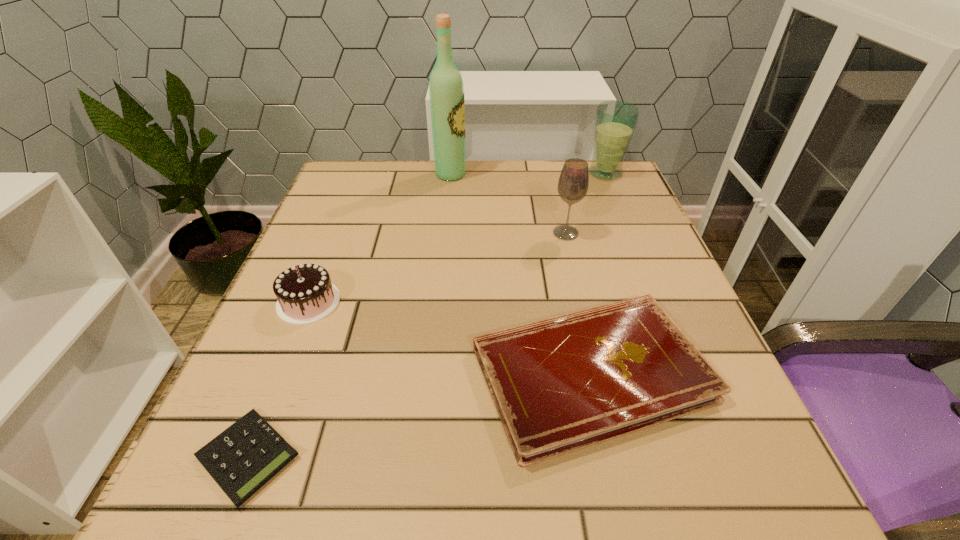
Identify which object is located as the second nearest to the calculator. Please provide its 2D coordinates. Your answer should be formatted as a tuple, i.e. [(x, y)], where the tuple contains the x and y coordinates of a point satisfying the conditions above.

[(565, 383)]

Where is `free location that satisfies the following two spatial constraints: 1. on the back side of the right glass drink container; 2. on the left side of the second shortest object`? The width and height of the screenshot is (960, 540). free location that satisfies the following two spatial constraints: 1. on the back side of the right glass drink container; 2. on the left side of the second shortest object is located at coordinates [x=546, y=173].

Identify the location of blank area in the image that satisfies the following two spatial constraints: 1. on the back side of the left glass drink container; 2. on the left side of the chocolate cake. Image resolution: width=960 pixels, height=540 pixels. (336, 233).

Locate an element on the screen. vacant position in the image that satisfies the following two spatial constraints: 1. on the back side of the calculator; 2. on the right side of the third farthest object is located at coordinates (338, 233).

Identify the location of free region that satisfies the following two spatial constraints: 1. on the back side of the calculator; 2. on the right side of the notebook. This screenshot has height=540, width=960. (281, 374).

In order to click on vacant point that satisfies the following two spatial constraints: 1. on the front-facing side of the fourth object from right to left; 2. on the right side of the fourth nearest object in this screenshot , I will do `click(444, 233)`.